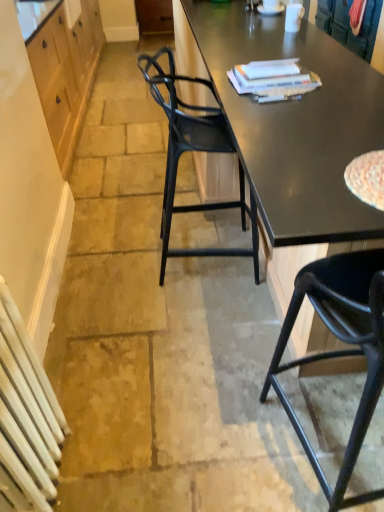
Where is `free area in between white painted metal radiator at lower left and black plastic chair at center, acting as the 2th chair starting from the front`? free area in between white painted metal radiator at lower left and black plastic chair at center, acting as the 2th chair starting from the front is located at coordinates (149, 354).